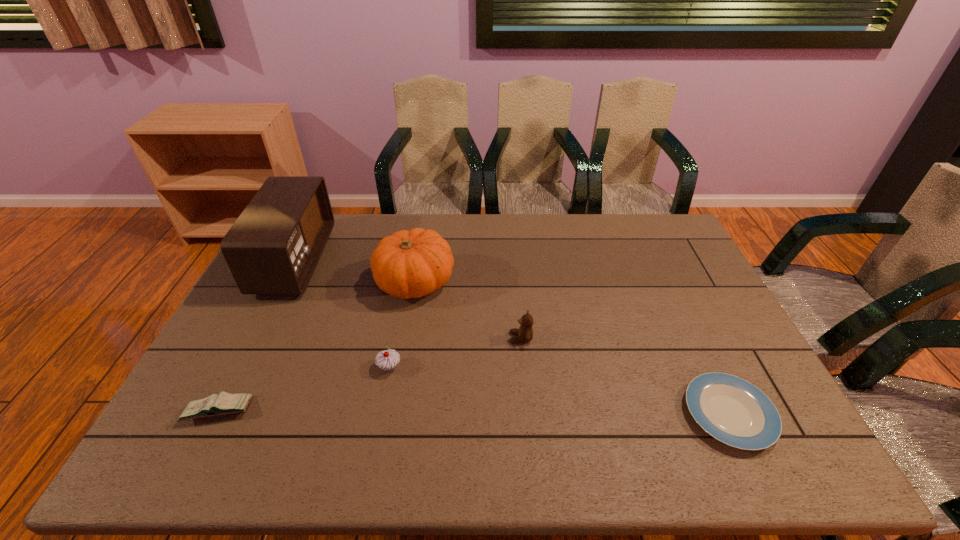
The image size is (960, 540). I want to click on free spot located on the left of the fourth farthest object, so click(x=306, y=368).

The image size is (960, 540). Find the location of `free location located 0.240m at the face of the second object from right to left`. free location located 0.240m at the face of the second object from right to left is located at coordinates (425, 338).

You are a GUI agent. You are given a task and a screenshot of the screen. Output one action in this format:
    pyautogui.click(x=<x>, y=<y>)
    Task: Click on the blank space located 0.310m at the face of the second object from right to left
    Image resolution: width=960 pixels, height=540 pixels.
    Given the screenshot: What is the action you would take?
    pyautogui.click(x=401, y=338)

The image size is (960, 540). Identify the location of vacant space located at the face of the second object from right to left. (384, 338).

Find the location of `free space located on the back of the diary`. free space located on the back of the diary is located at coordinates (241, 367).

The height and width of the screenshot is (540, 960). In order to click on vacant space located on the left of the rightmost object in this screenshot , I will do `click(628, 414)`.

At what (x,y) coordinates should I click in order to perform the action: click on object situated at the far edge. Please return your answer as a coordinate pair (x, y). The height and width of the screenshot is (540, 960). Looking at the image, I should click on (274, 246).

The height and width of the screenshot is (540, 960). What are the coordinates of `object located in the near edge section of the desktop` in the screenshot? It's located at (732, 410).

Locate an element on the screen. The image size is (960, 540). radio receiver that is at the left edge is located at coordinates (274, 246).

You are a GUI agent. You are given a task and a screenshot of the screen. Output one action in this format:
    pyautogui.click(x=<x>, y=<y>)
    Task: Click on the diary present at the left edge
    The height and width of the screenshot is (540, 960).
    Given the screenshot: What is the action you would take?
    pyautogui.click(x=225, y=403)